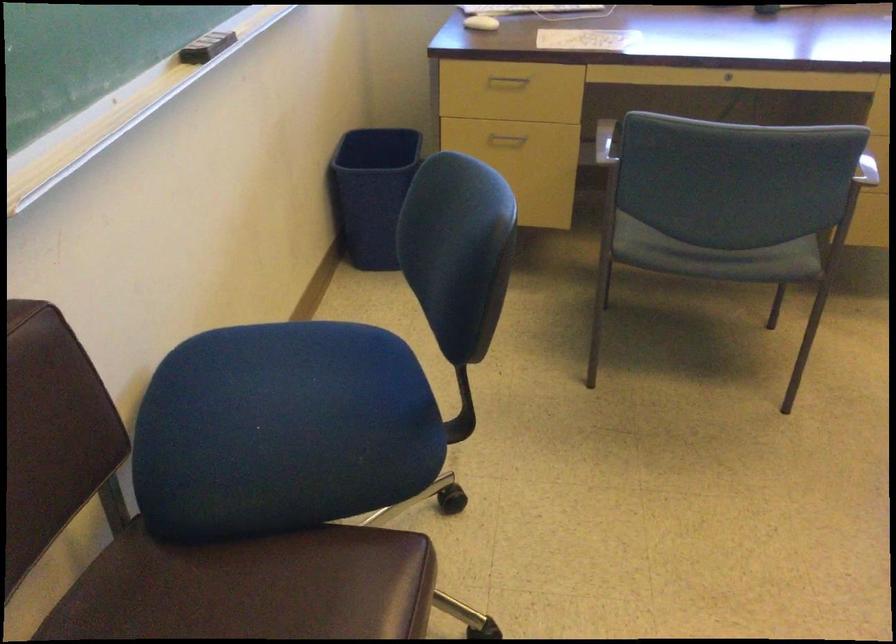
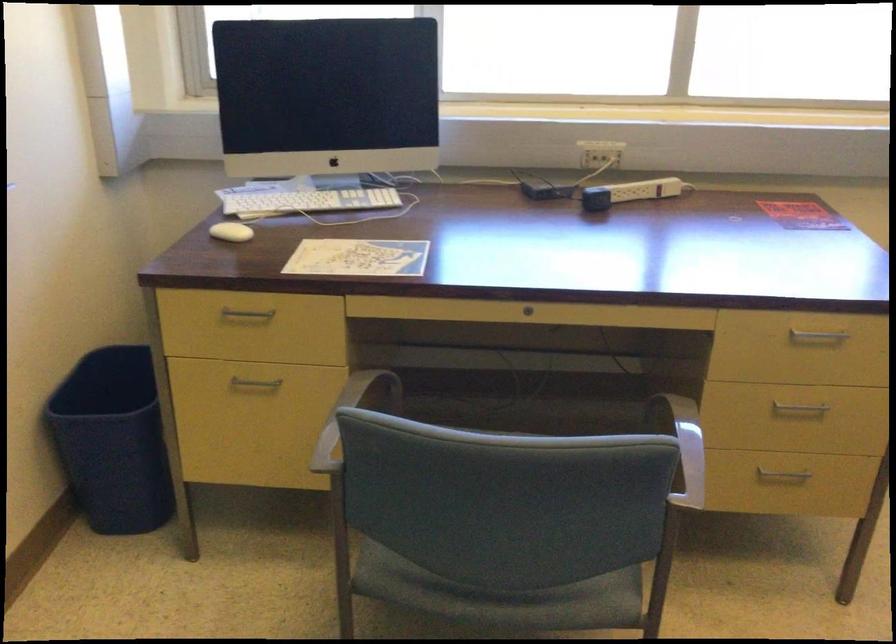
Locate, in the second image, the point that corresponds to [504,77] in the first image.

(247, 313)